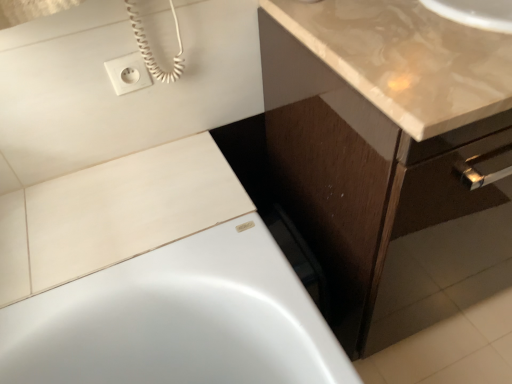
Question: Based on their positions, is white matte tile at upper left located to the left or right of white plastic outlet at upper left?

Choices:
 (A) right
 (B) left

Answer: (B)

Question: From the image's perspective, relative to white plastic outlet at upper left, is white matte tile at upper left above or below?

Choices:
 (A) below
 (B) above

Answer: (A)

Question: Based on their relative distances, which object is farther from the brown wood cabinet at lower right?

Choices:
 (A) white plastic outlet at upper left
 (B) white matte tile at upper left
 (C) glossy beige countertop at upper right

Answer: (A)

Question: Which is nearer to the glossy beige countertop at upper right?

Choices:
 (A) brown wood cabinet at lower right
 (B) white plastic outlet at upper left
 (C) white matte tile at upper left

Answer: (A)